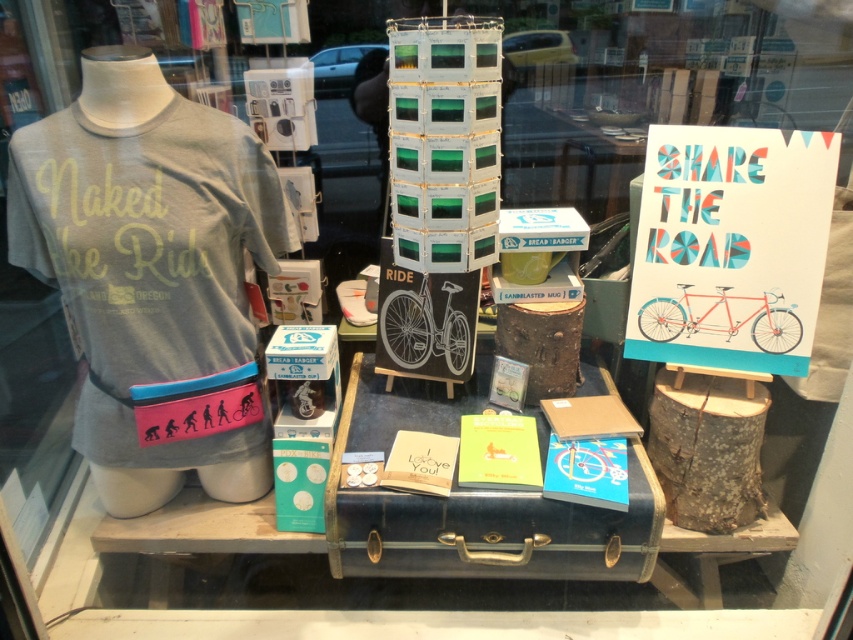
You are standing in front of the window display and want to touch the point at coordinates (x=103, y=138). Can you reach it without moving your body?

The point at coordinates (x=103, y=138) is 1.29 meters from the viewer. Since the average arm length is about 0.7 meters, you cannot reach it without moving your body.